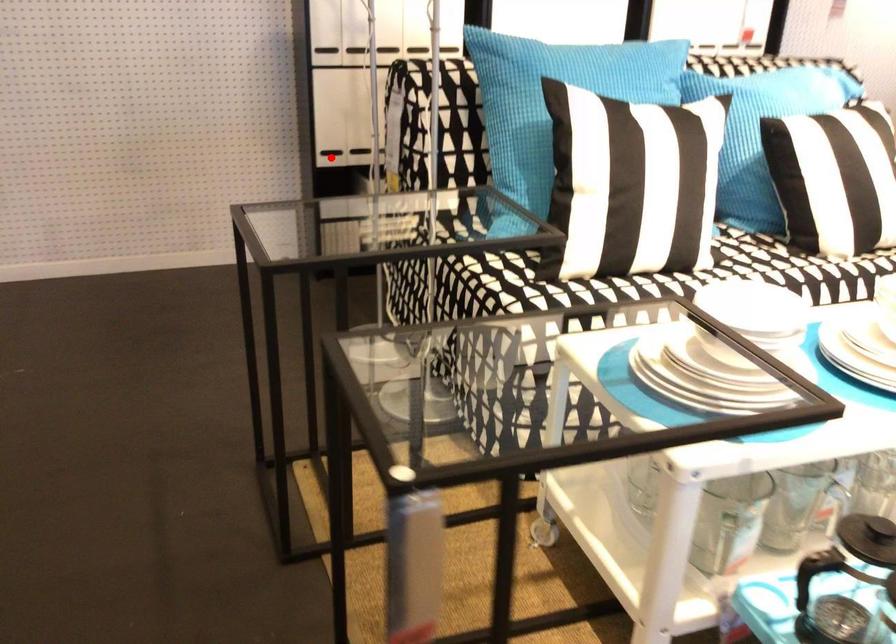
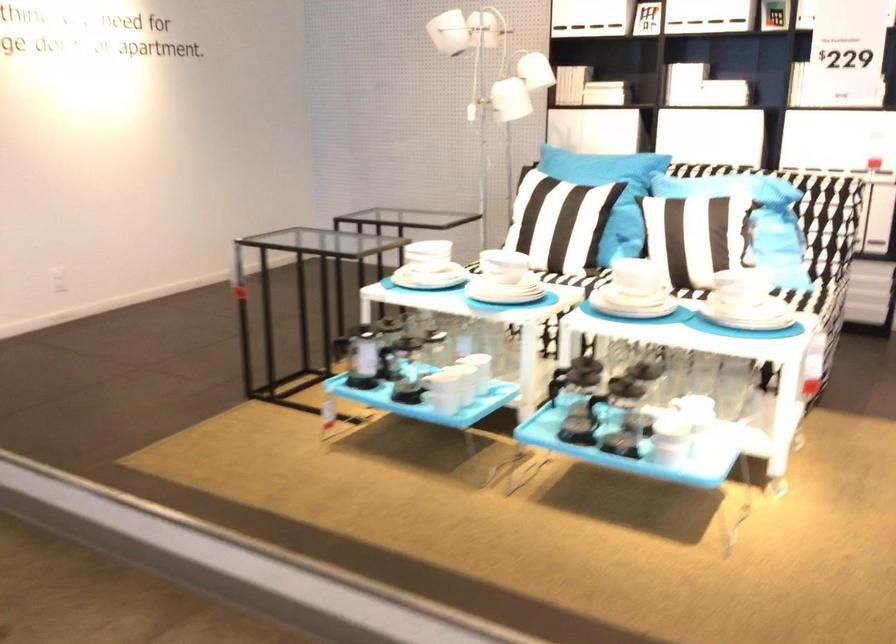
Question: I am providing you with two images of the same scene from different viewpoints. A red point is marked on the first image. Is the red point's position out of view in image 2?

Choices:
 (A) Yes
 (B) No

Answer: (A)